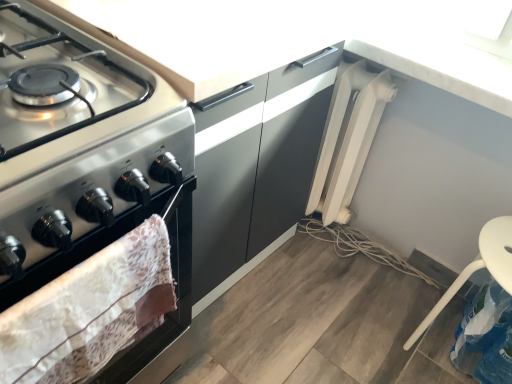
Question: Is white plastic radiator at lower right bigger than white plastic chair at lower right?

Choices:
 (A) yes
 (B) no

Answer: (B)

Question: Is white plastic radiator at lower right smaller than white plastic chair at lower right?

Choices:
 (A) yes
 (B) no

Answer: (A)

Question: From a real-world perspective, is white plastic radiator at lower right positioned under white plastic chair at lower right based on gravity?

Choices:
 (A) no
 (B) yes

Answer: (B)

Question: Does white plastic radiator at lower right contain white plastic chair at lower right?

Choices:
 (A) yes
 (B) no

Answer: (B)

Question: From the image's perspective, does white plastic radiator at lower right appear lower than white plastic chair at lower right?

Choices:
 (A) no
 (B) yes

Answer: (A)

Question: Does white plastic radiator at lower right touch white plastic chair at lower right?

Choices:
 (A) no
 (B) yes

Answer: (A)

Question: Is white plastic radiator at lower right surrounded by matte silver oven at left?

Choices:
 (A) yes
 (B) no

Answer: (B)

Question: Is matte silver oven at left facing towards white plastic radiator at lower right?

Choices:
 (A) yes
 (B) no

Answer: (B)

Question: Is matte silver oven at left not close to white plastic radiator at lower right?

Choices:
 (A) no
 (B) yes

Answer: (A)

Question: From the image's perspective, is matte silver oven at left on white plastic radiator at lower right?

Choices:
 (A) no
 (B) yes

Answer: (B)

Question: Is matte silver oven at left to the left of white plastic radiator at lower right from the viewer's perspective?

Choices:
 (A) yes
 (B) no

Answer: (A)

Question: From the image's perspective, is matte silver oven at left below white plastic radiator at lower right?

Choices:
 (A) no
 (B) yes

Answer: (A)

Question: From the image's perspective, would you say white plastic chair at lower right is shown under white plastic radiator at lower right?

Choices:
 (A) yes
 (B) no

Answer: (A)